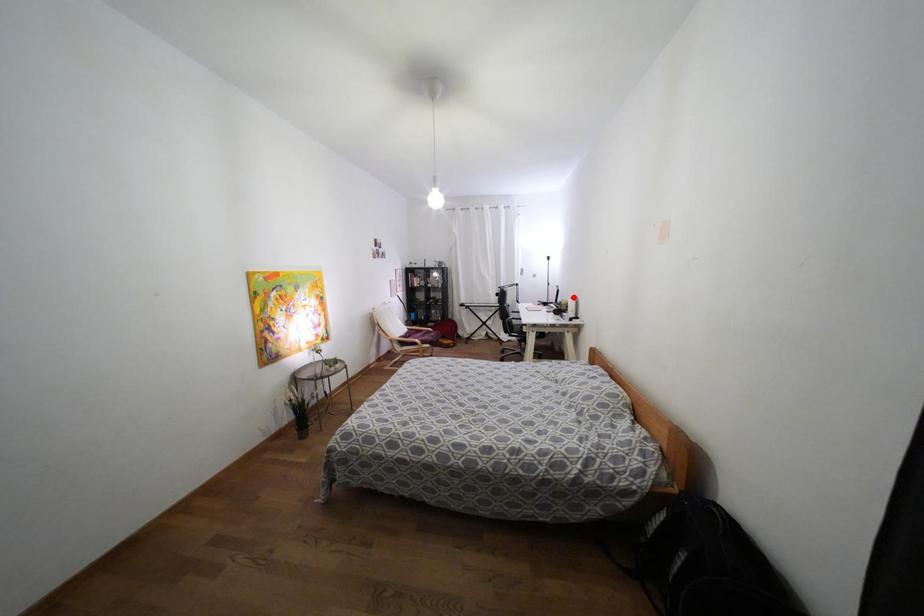
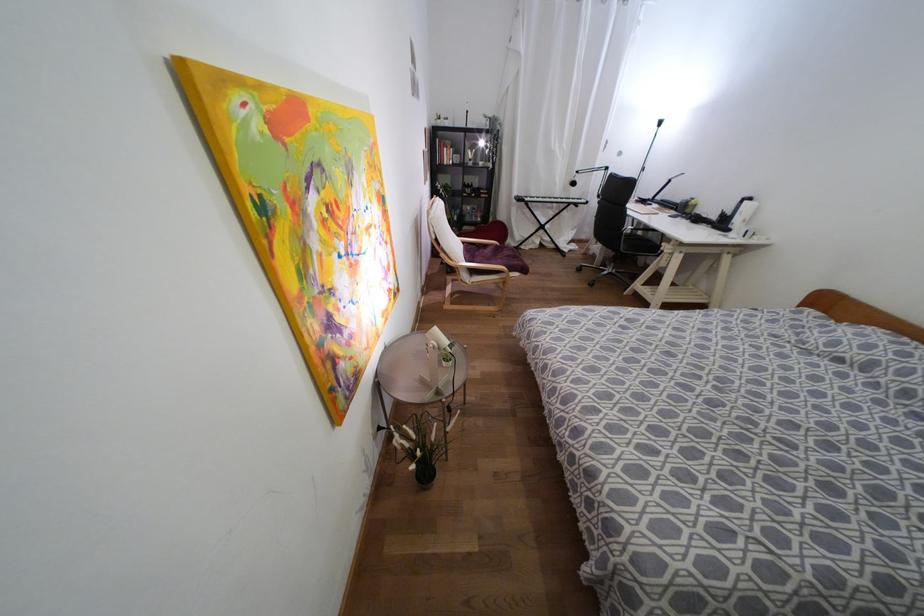
Question: I am providing you with two images of the same scene from different viewpoints. In image1, a red point is highlighted. Considering the same 3D point in image2, which of the following is correct?

Choices:
 (A) It is closer
 (B) It is farther

Answer: (B)